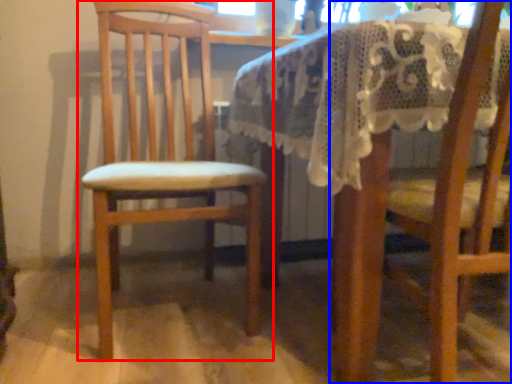
Question: Which object is further to the camera taking this photo, chair (highlighted by a red box) or chair (highlighted by a blue box)?

Choices:
 (A) chair
 (B) chair

Answer: (A)